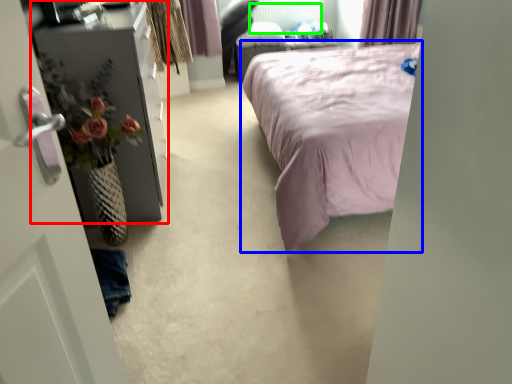
Question: Which object is the farthest from furniture (highlighted by a red box)? Choose among these: bed (highlighted by a blue box) or radiator (highlighted by a green box).

Choices:
 (A) bed
 (B) radiator

Answer: (B)